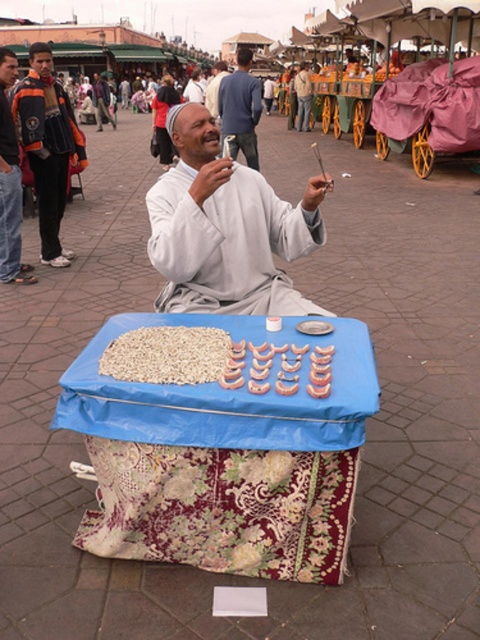
You are a customer at the market and want to point out two specific points in the scene. The first point is at coordinates point [38,42] and the second is at point [330,368]. Which point is closer to you?

Point [38,42] is closer to you because it is further to the camera than point [330,368].

You are a customer at the market and want to touch both the light blue fabric at center and the matte gray shirt at center. Which one is easier to reach if you are standing directly in front of the vendor?

The light blue fabric at center is easier to reach because it has a smaller size compared to the matte gray shirt at center, making it closer to your hand.

You are a customer at the market and want to buy some roasted nuts and pastries. The vendor points to two points on his table. The first point is at coordinates point (x=301, y=116), and the second is at point (x=212, y=92). He says, quot the item you want is behind the other one quot. Which point should you look behind?

Point (x=301, y=116) is behind point (x=212, y=92), so you should look behind point (x=212, y=92) to find the item.